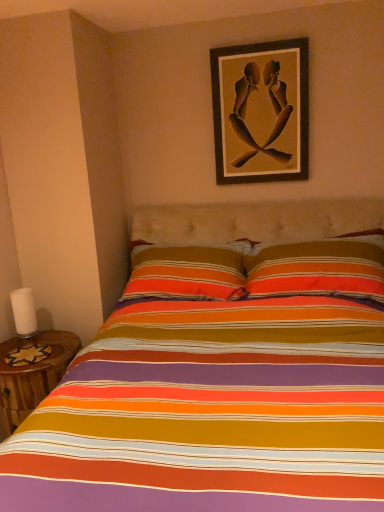
Where is `white matte candle at left`? This screenshot has width=384, height=512. white matte candle at left is located at coordinates (24, 312).

At what (x,y) coordinates should I click in order to perform the action: click on wooden picture frame at upper center. Please return your answer as a coordinate pair (x, y). Image resolution: width=384 pixels, height=512 pixels. Looking at the image, I should click on [x=261, y=111].

The height and width of the screenshot is (512, 384). Find the location of `wooden table at lower left`. wooden table at lower left is located at coordinates (32, 376).

What do you see at coordinates (32, 376) in the screenshot? Image resolution: width=384 pixels, height=512 pixels. I see `wooden table at lower left` at bounding box center [32, 376].

Where is `white matte candle at left`? This screenshot has height=512, width=384. white matte candle at left is located at coordinates (24, 312).

Can you confirm if white matte candle at left is smaller than wooden table at lower left?

Yes.

Does white matte candle at left have a greater height compared to wooden table at lower left?

No.

From the image's perspective, is white matte candle at left above or below wooden table at lower left?

white matte candle at left is above wooden table at lower left.

Is point (22, 306) closer or farther from the camera than point (2, 435)?

Point (22, 306) is positioned farther from the camera compared to point (2, 435).

From the image's perspective, between wooden table at lower left and wooden picture frame at upper center, which one is located above?

Answer: wooden picture frame at upper center, from the image's perspective.

Is wooden table at lower left far from wooden picture frame at upper center?

Yes, wooden table at lower left is far from wooden picture frame at upper center.

How many degrees apart are the facing directions of wooden table at lower left and wooden picture frame at upper center?

→ There is a 0.32-degree angle between the facing directions of wooden table at lower left and wooden picture frame at upper center.

Does wooden table at lower left appear on the left side of wooden picture frame at upper center?

Correct, you'll find wooden table at lower left to the left of wooden picture frame at upper center.

Looking at this image, between white matte candle at left and wooden picture frame at upper center, which one has smaller size?

Smaller between the two is white matte candle at left.

Can you see white matte candle at left touching wooden picture frame at upper center?

No, white matte candle at left is not in contact with wooden picture frame at upper center.

Relative to wooden table at lower left, is wooden picture frame at upper center in front or behind?

Visually, wooden picture frame at upper center is located behind wooden table at lower left.

How many degrees apart are the facing directions of wooden picture frame at upper center and wooden table at lower left?

There is a 0.32-degree angle between the facing directions of wooden picture frame at upper center and wooden table at lower left.

Who is bigger, wooden picture frame at upper center or wooden table at lower left?

Bigger between the two is wooden table at lower left.

Could wooden table at lower left be considered to be inside wooden picture frame at upper center?

No, wooden picture frame at upper center does not contain wooden table at lower left.

Based on their sizes in the image, would you say wooden table at lower left is bigger or smaller than white matte candle at left?

wooden table at lower left is bigger than white matte candle at left.

Is white matte candle at left located within wooden table at lower left?

Actually, white matte candle at left is outside wooden table at lower left.

Does point (59, 377) come behind point (33, 298)?

No, (59, 377) is closer to viewer.

Which is more to the left, wooden table at lower left or white matte candle at left?

From the viewer's perspective, white matte candle at left appears more on the left side.

In terms of width, does wooden picture frame at upper center look wider or thinner when compared to white matte candle at left?

wooden picture frame at upper center is thinner than white matte candle at left.

Could white matte candle at left be considered to be inside wooden picture frame at upper center?

No, white matte candle at left is not inside wooden picture frame at upper center.

Is wooden picture frame at upper center positioned with its back to white matte candle at left?

wooden picture frame at upper center does not have its back to white matte candle at left.

Between wooden picture frame at upper center and white matte candle at left, which one appears on the left side from the viewer's perspective?

Positioned to the left is white matte candle at left.

Where is `candle on the left of wooden table at lower left`? candle on the left of wooden table at lower left is located at coordinates (24, 312).

Image resolution: width=384 pixels, height=512 pixels. Identify the location of table that appears below the wooden picture frame at upper center (from a real-world perspective). (32, 376).

When comparing their distances from white matte candle at left, does wooden table at lower left or wooden picture frame at upper center seem further?

Among the two, wooden picture frame at upper center is located further to white matte candle at left.

Which object lies further to the anchor point wooden table at lower left, wooden picture frame at upper center or white matte candle at left?

Based on the image, wooden picture frame at upper center appears to be further to wooden table at lower left.

Considering their positions, is wooden picture frame at upper center positioned closer to white matte candle at left than wooden table at lower left?

wooden table at lower left.

Estimate the real-world distances between objects in this image. Which object is closer to wooden table at lower left, white matte candle at left or wooden picture frame at upper center?

Based on the image, white matte candle at left appears to be nearer to wooden table at lower left.

From the image, which object appears to be farther from wooden picture frame at upper center, wooden table at lower left or white matte candle at left?

white matte candle at left lies further to wooden picture frame at upper center than the other object.

Which object lies further to the anchor point wooden picture frame at upper center, white matte candle at left or wooden table at lower left?

Based on the image, white matte candle at left appears to be further to wooden picture frame at upper center.

Image resolution: width=384 pixels, height=512 pixels. I want to click on candle between wooden picture frame at upper center and wooden table at lower left in the up-down direction, so click(24, 312).